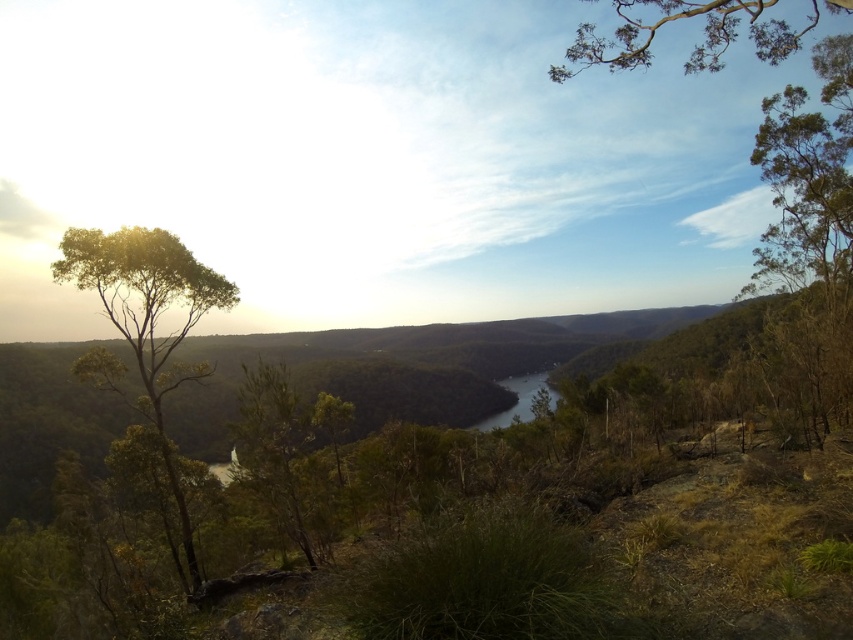
You are an explorer standing in the middle of the valley. You see the green leafy tree at left and the green leafy tree at upper right. Which tree is closer to the ground?

The green leafy tree at left is closer to the ground because it is positioned below the green leafy tree at upper right.

You are standing at the point marked by the coordinates point (148,320) in the scene. Looking around, you see a green leafy tree at left and the winding river or stream in the middle ground. Which direction should you walk to reach the river?

The point (148,320) corresponds to the green leafy tree at left. To reach the winding river or stream in the middle ground, you should walk towards the center of the scene, away from the tree.

You are standing at the edge of the rugged terrain in the foreground and want to cross the river. You notice the green leafy tree at upper right and the shiny dark water at center. Which direction should you head towards to reach the river first?

You should head towards the shiny dark water at center first because it is located at the center of the scene, while the green leafy tree at upper right is positioned to the right of it. Since the river is represented by the shiny dark water at center, moving toward the center will lead you to the river before reaching the tree.